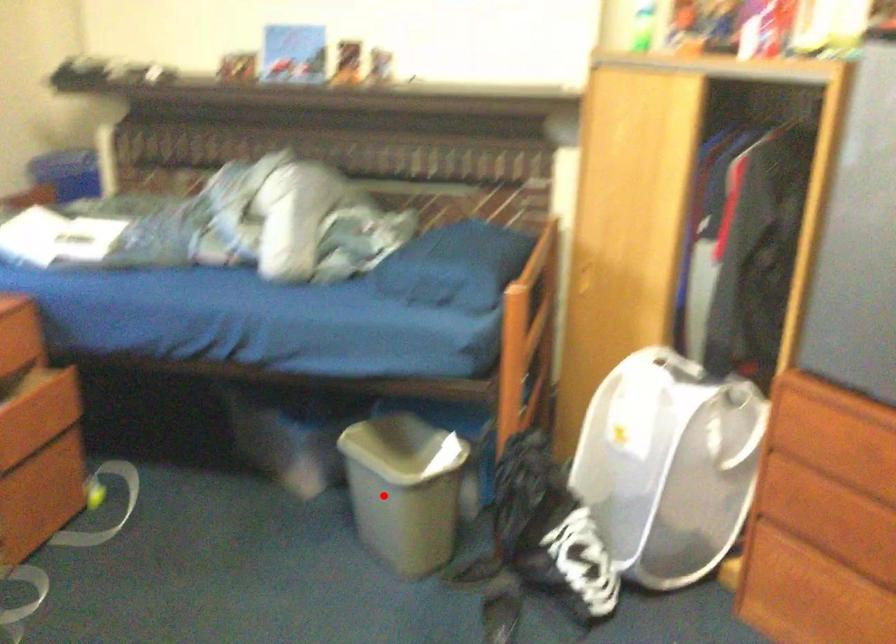
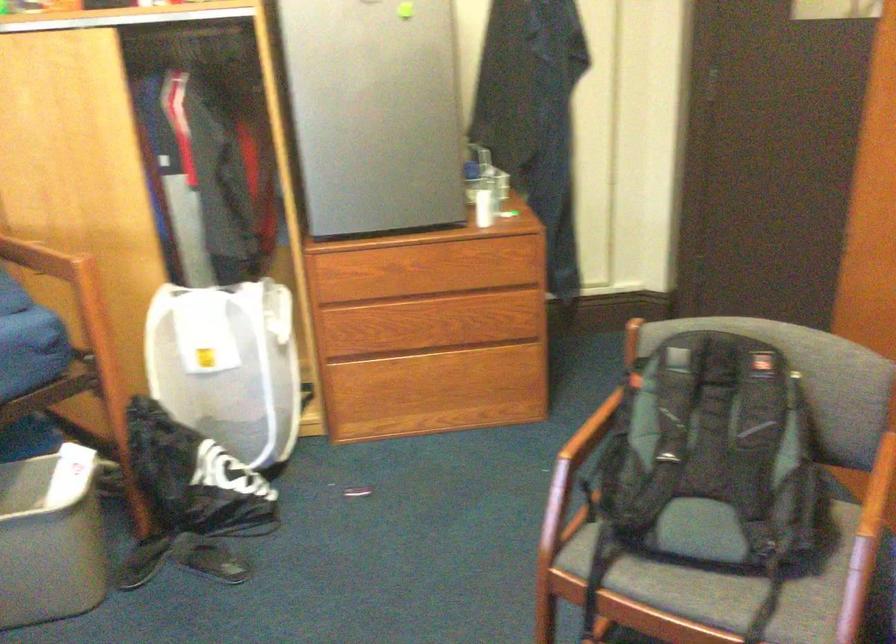
Question: I am providing you with two images of the same scene from different viewpoints. A red point is shown in image1. For the corresponding object point in image2, is it positioned nearer or farther from the camera?

Choices:
 (A) Nearer
 (B) Farther

Answer: (A)